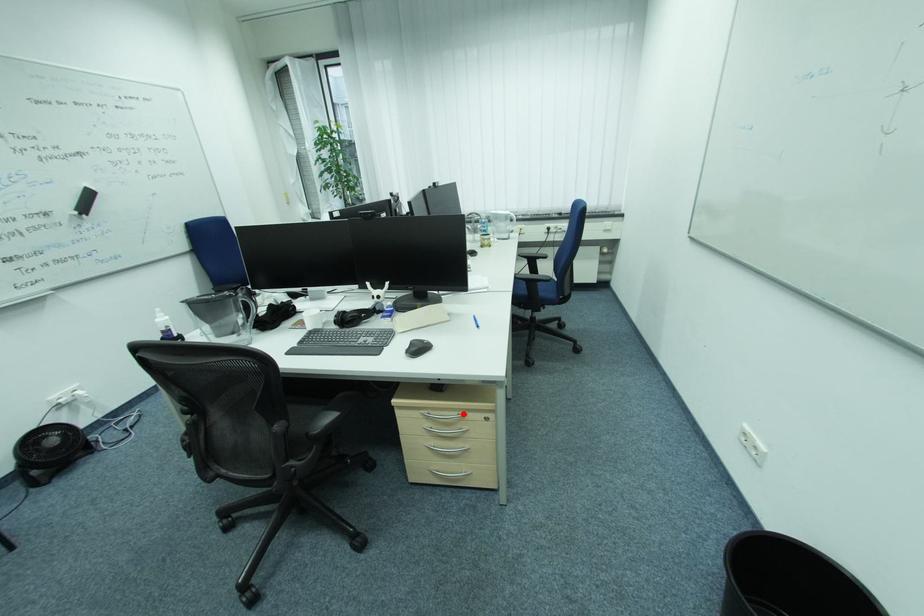
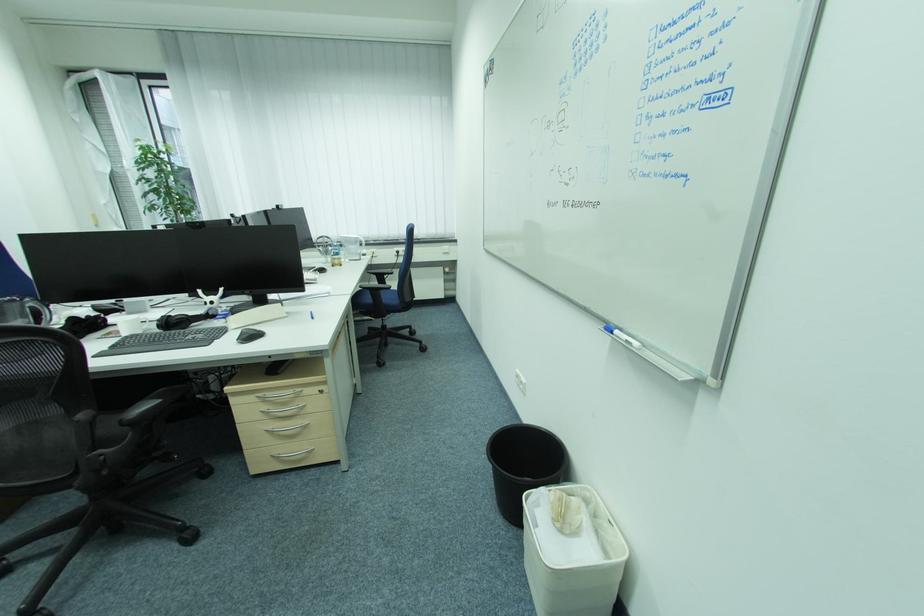
Where in the second image is the point corresponding to the highlighted location from the first image?

(299, 392)